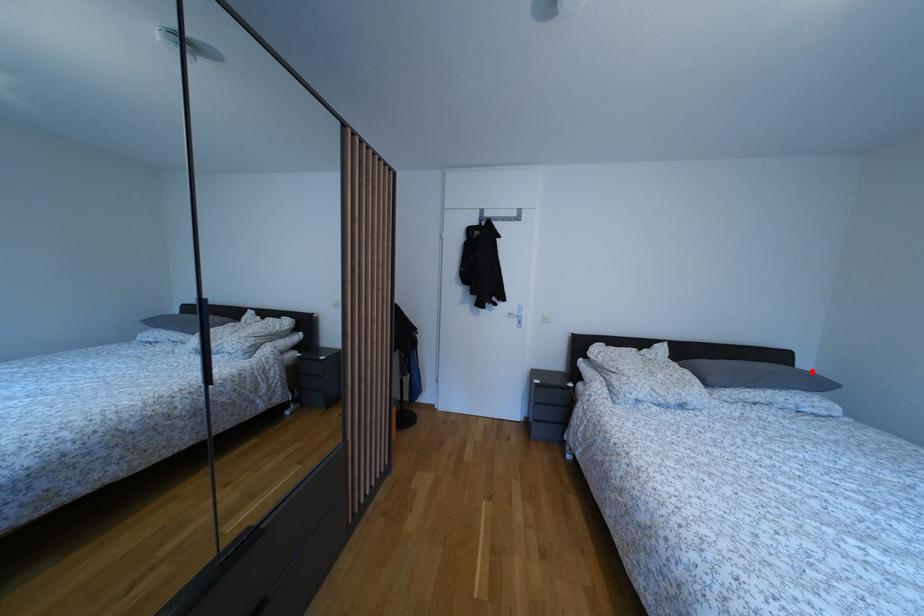
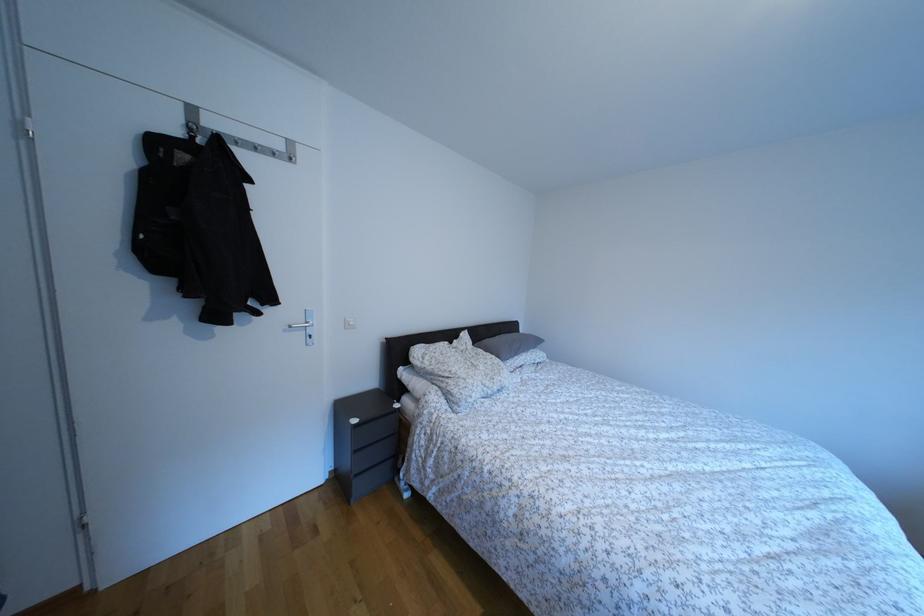
Question: I am providing you with two images of the same scene from different viewpoints. In image1, a red point is highlighted. Considering the same 3D point in image2, which of the following is correct?

Choices:
 (A) It is closer
 (B) It is farther

Answer: (B)